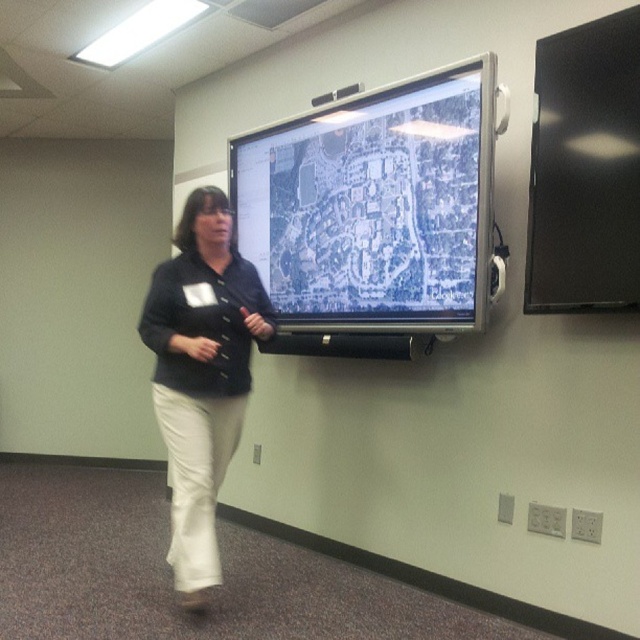
This screenshot has height=640, width=640. In order to click on white matte projection screen at upper center in this screenshot , I will do `click(374, 205)`.

Can you confirm if white matte projection screen at upper center is positioned to the right of matte black shirt at center?

Correct, you'll find white matte projection screen at upper center to the right of matte black shirt at center.

Describe the element at coordinates (374, 205) in the screenshot. I see `white matte projection screen at upper center` at that location.

You are a GUI agent. You are given a task and a screenshot of the screen. Output one action in this format:
    pyautogui.click(x=<x>, y=<y>)
    Task: Click on the white matte projection screen at upper center
    The height and width of the screenshot is (640, 640).
    Given the screenshot: What is the action you would take?
    pyautogui.click(x=374, y=205)

Between white matte projection screen at upper center and black glossy screen at upper right, which one is positioned higher?

black glossy screen at upper right is higher up.

Is point (276, 192) positioned before point (532, 211)?

No.

You are a GUI agent. You are given a task and a screenshot of the screen. Output one action in this format:
    pyautogui.click(x=<x>, y=<y>)
    Task: Click on the white matte projection screen at upper center
    
    Given the screenshot: What is the action you would take?
    374,205

Is black glossy screen at upper right above matte black shirt at center?

Correct, black glossy screen at upper right is located above matte black shirt at center.

Is black glossy screen at upper right closer to camera compared to matte black shirt at center?

Yes, black glossy screen at upper right is closer to the viewer.

Is point (545, 225) in front of point (140, 326)?

Yes, it is.

What are the coordinates of `black glossy screen at upper right` in the screenshot? It's located at (584, 170).